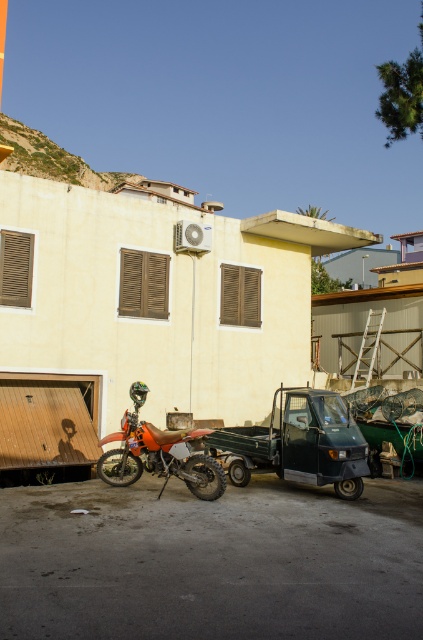
You are a delivery person who needs to load a package onto the green matte pickup truck at center. However, there is an orange matte dirt bike at center in the way. Can you drive the pickup truck forward to move it out of the way without hitting the dirt bike?

The green matte pickup truck at center is taller than orange matte dirt bike at center. Since the pickup truck is taller, you can drive it forward carefully to move it out of the way without hitting the dirt bike as long as there is enough space horizontally between them.

You are a delivery person who needs to unload packages from the green matte pickup truck at center to the orange matte dirt bike at center. The packages are 5 feet long. Can you safely move the packages between them without bending or lifting them?

The distance between the green matte pickup truck at center and the orange matte dirt bike at center is 4.57 feet. Since the packages are 5 feet long, they cannot be moved straight between them without bending or lifting due to the insufficient space.

You are standing at the point marked by coordinates point (282, 424) in the image. You want to walk to the entrance of the two story building painted in light yellow hue. Is the entrance within a 10 meter radius from your current position?

The distance between point (282, 424) and the viewer is 10.31 meters, which is slightly beyond the 10 meter radius. Therefore, the entrance of the two story building painted in light yellow hue is not within the 10 meter radius from your current position.